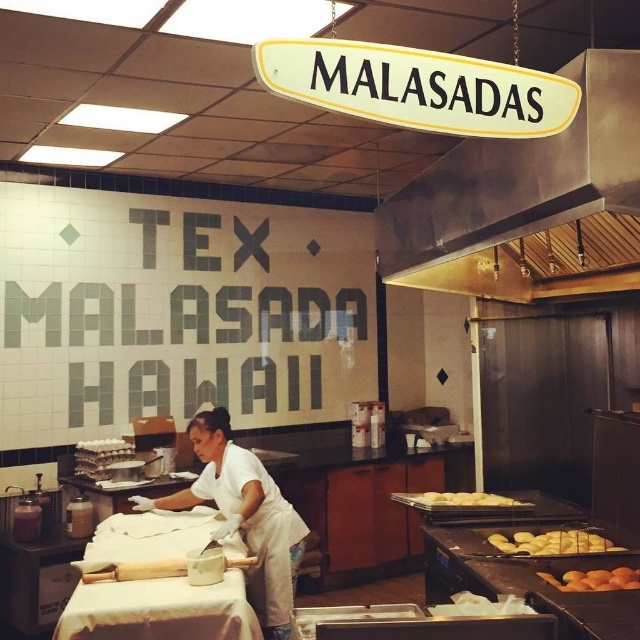
Who is more forward, (x=547, y=534) or (x=476, y=499)?

Positioned in front is point (x=547, y=534).

Describe the element at coordinates (552, 541) in the screenshot. Image resolution: width=640 pixels, height=640 pixels. I see `golden crispy malasadas at lower center` at that location.

Find the location of a particular element. golden crispy malasadas at lower center is located at coordinates (552, 541).

You are a GUI agent. You are given a task and a screenshot of the screen. Output one action in this format:
    pyautogui.click(x=<x>, y=<y>)
    Task: Click on the golden crispy malasadas at lower center
    Image resolution: width=640 pixels, height=640 pixels.
    Given the screenshot: What is the action you would take?
    pyautogui.click(x=552, y=541)

Which is below, stainless steel exhaust hood at upper center or golden brown doughnuts at center?

golden brown doughnuts at center is below.

Is point (582, 170) more distant than point (513, 502)?

No, (582, 170) is in front of (513, 502).

The image size is (640, 640). I want to click on stainless steel exhaust hood at upper center, so click(516, 189).

Which is more to the left, golden brown doughnuts at lower right or golden brown doughnuts at center?

golden brown doughnuts at center is more to the left.

Does point (589, 584) lie in front of point (442, 493)?

Yes, point (589, 584) is closer to viewer.

Where is `golden brown doughnuts at lower right`? This screenshot has height=640, width=640. golden brown doughnuts at lower right is located at coordinates (595, 579).